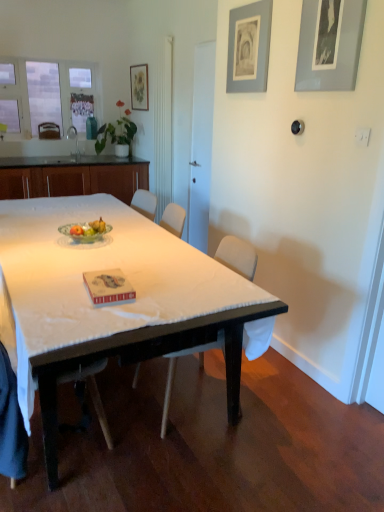
Identify the location of free space in front of white plastic chair at center, which ranks as the third chair in left-to-right order. (189, 463).